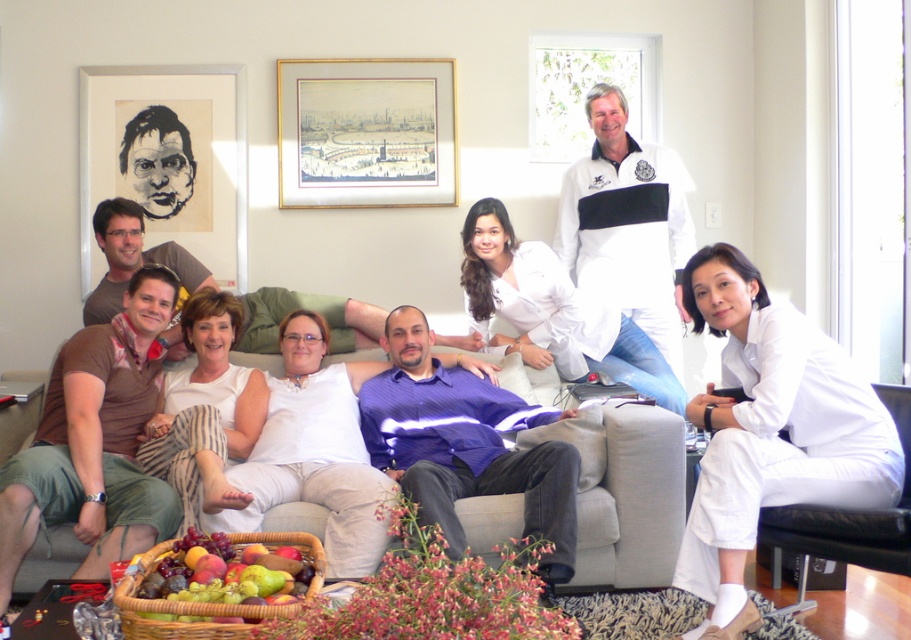
Between white cotton pants at center and gray fabric couch at center, which one is positioned higher?

white cotton pants at center is higher up.

Which is behind, point (698, 305) or point (36, 576)?

The point (36, 576) is behind.

The image size is (911, 640). What do you see at coordinates (770, 432) in the screenshot? I see `white cotton pants at center` at bounding box center [770, 432].

You are a GUI agent. You are given a task and a screenshot of the screen. Output one action in this format:
    pyautogui.click(x=<x>, y=<y>)
    Task: Click on the white cotton pants at center
    This screenshot has width=911, height=640.
    Given the screenshot: What is the action you would take?
    pyautogui.click(x=770, y=432)

Who is positioned more to the right, white cotton pants at center or purple striped shirt at center?

From the viewer's perspective, white cotton pants at center appears more on the right side.

Can you confirm if white cotton pants at center is thinner than purple striped shirt at center?

Indeed, white cotton pants at center has a lesser width compared to purple striped shirt at center.

The width and height of the screenshot is (911, 640). In order to click on white cotton pants at center in this screenshot , I will do `click(770, 432)`.

Can you confirm if white matte jacket at center is bigger than black paper portrait at upper left?

Yes, white matte jacket at center is bigger than black paper portrait at upper left.

Is point (656, 316) positioned in front of point (83, 252)?

Yes, point (656, 316) is closer to viewer.

Image resolution: width=911 pixels, height=640 pixels. Describe the element at coordinates (628, 250) in the screenshot. I see `white matte jacket at center` at that location.

I want to click on white matte jacket at center, so click(628, 250).